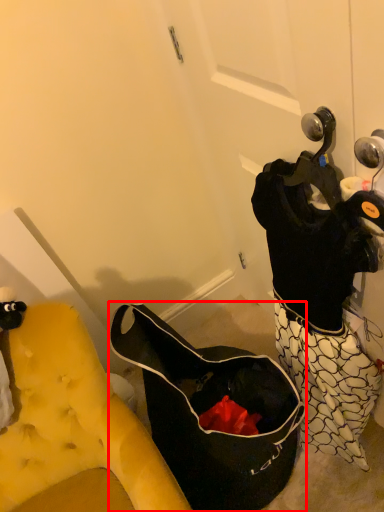
Question: From the image's perspective, what is the correct spatial relationship of handbag (annotated by the red box) in relation to furniture?

Choices:
 (A) above
 (B) below

Answer: (A)